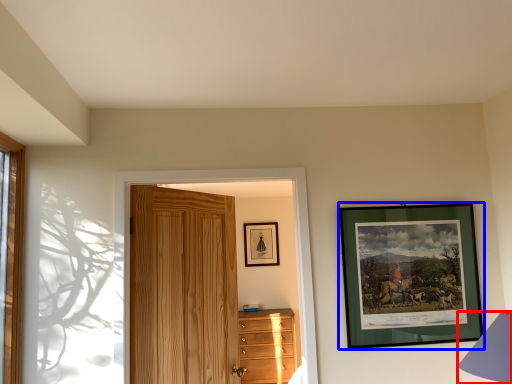
Question: Which of the following is the closest to the observer, table lamp (highlighted by a red box) or picture frame (highlighted by a blue box)?

Choices:
 (A) table lamp
 (B) picture frame

Answer: (A)